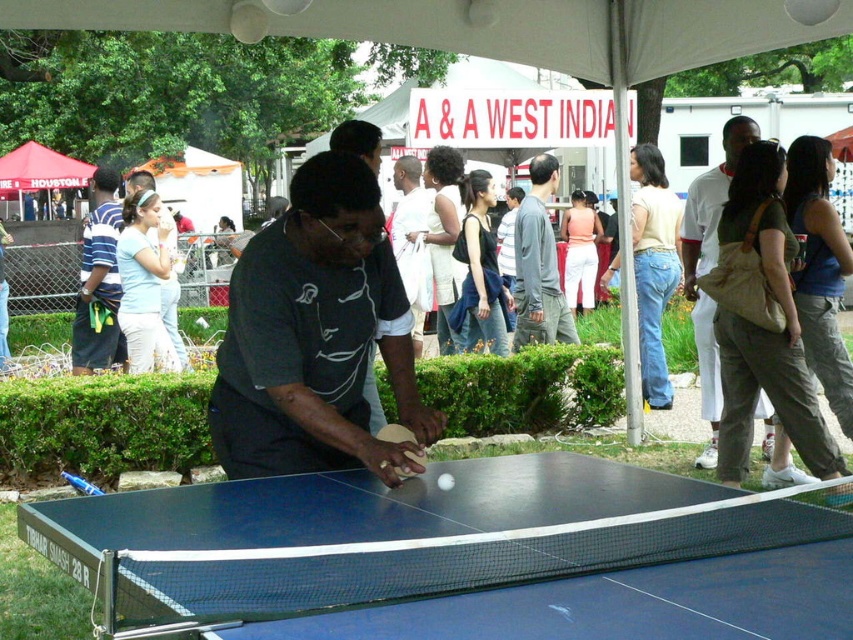
Between point (109, 355) and point (18, 179), which one is positioned behind?

The point (18, 179) is behind.

Who is higher up, striped cotton shirt at left or red fabric canopy at upper left?

red fabric canopy at upper left

Find the location of a particular element. striped cotton shirt at left is located at coordinates (97, 280).

Who is more distant from viewer, (572, 332) or (96, 492)?

The point (572, 332) is behind.

The height and width of the screenshot is (640, 853). What do you see at coordinates (538, 264) in the screenshot? I see `gray cotton shirt at center` at bounding box center [538, 264].

You are a GUI agent. You are given a task and a screenshot of the screen. Output one action in this format:
    pyautogui.click(x=<x>, y=<y>)
    Task: Click on the gray cotton shirt at center
    
    Given the screenshot: What is the action you would take?
    pyautogui.click(x=538, y=264)

Between dark gray shirt at center and white cotton shirt at right, which one is positioned lower?

dark gray shirt at center

Does dark gray shirt at center have a lesser width compared to white cotton shirt at right?

No, dark gray shirt at center is not thinner than white cotton shirt at right.

Which is behind, point (306, 280) or point (764, 440)?

Point (764, 440)

Locate an element on the screen. The height and width of the screenshot is (640, 853). dark gray shirt at center is located at coordinates (315, 337).